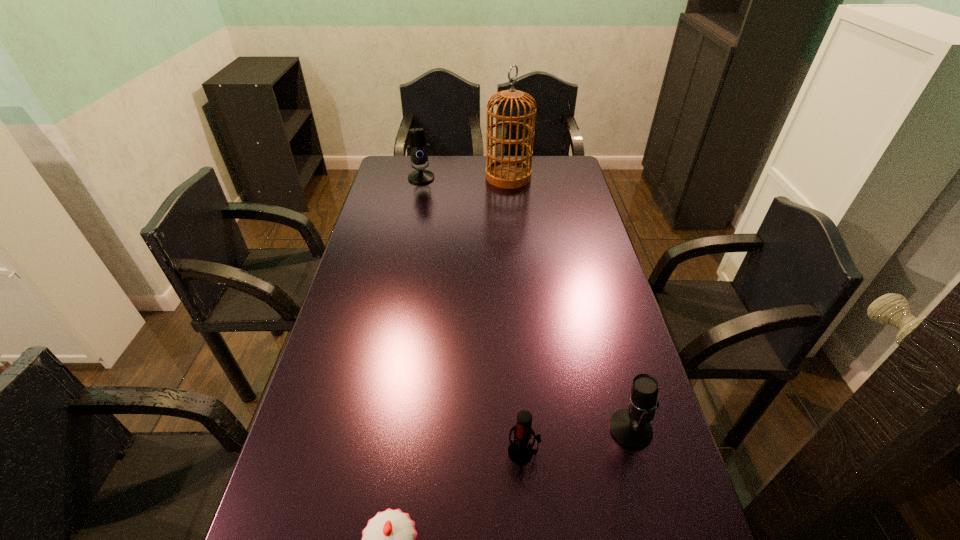
Find the location of a particular element. This screenshot has width=960, height=540. birdcage that is at the far edge is located at coordinates (509, 173).

Where is `microphone that is positioned at the far edge`? microphone that is positioned at the far edge is located at coordinates (419, 149).

Locate an element on the screen. The width and height of the screenshot is (960, 540). object located at the left edge is located at coordinates (419, 149).

Find the location of a particular element. The height and width of the screenshot is (540, 960). object present at the right edge is located at coordinates (631, 427).

At what (x,y) coordinates should I click in order to perform the action: click on object that is at the far left corner. Please return your answer as a coordinate pair (x, y). This screenshot has height=540, width=960. Looking at the image, I should click on (419, 149).

Image resolution: width=960 pixels, height=540 pixels. I want to click on free spot at the left edge of the desktop, so click(308, 455).

Locate an element on the screen. The image size is (960, 540). vacant space at the right edge of the desktop is located at coordinates (576, 282).

Locate an element on the screen. Image resolution: width=960 pixels, height=540 pixels. empty space that is in between the leftmost microphone and the birdcage is located at coordinates (465, 177).

This screenshot has width=960, height=540. Identify the location of empty space between the farthest microphone and the third tallest object. (526, 303).

Where is `empty space that is in between the birdcage and the farthest microphone`? Image resolution: width=960 pixels, height=540 pixels. empty space that is in between the birdcage and the farthest microphone is located at coordinates (465, 177).